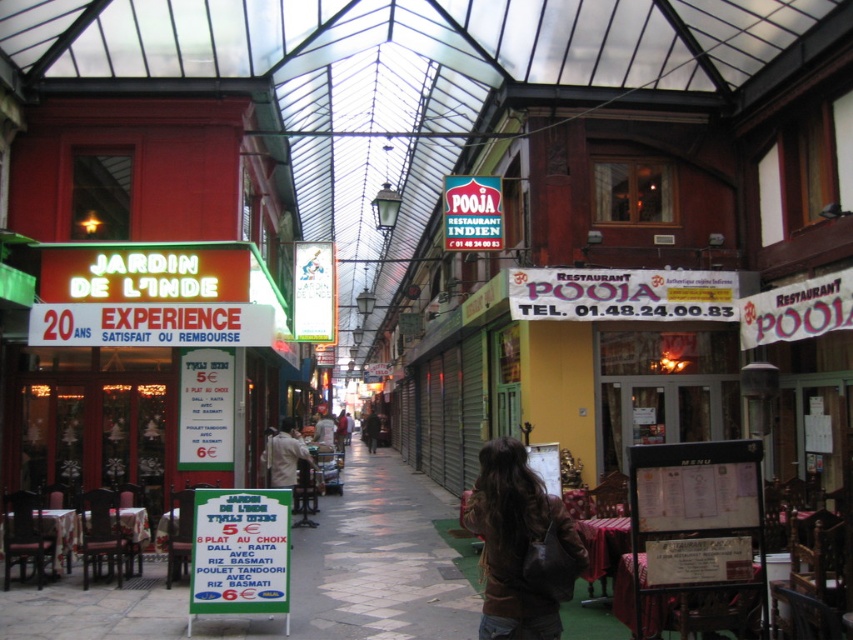
Can you confirm if matte plastic sign at center is positioned to the right of light brown leather jacket at center?

Yes, matte plastic sign at center is to the right of light brown leather jacket at center.

Does matte plastic sign at center lie in front of light brown leather jacket at center?

That is True.

At what (x,y) coordinates should I click in order to perform the action: click on matte plastic sign at center. Please return your answer as a coordinate pair (x, y). Looking at the image, I should click on (473, 212).

Is green plastic signboard at center thinner than dark brown leather jacket at center?

Indeed, green plastic signboard at center has a lesser width compared to dark brown leather jacket at center.

Where is `green plastic signboard at center`? The image size is (853, 640). green plastic signboard at center is located at coordinates (241, 552).

Who is more distant from viewer, (527, 508) or (457, 220)?

Point (457, 220)

Is brown leather jacket at center shorter than matte plastic sign at center?

Correct, brown leather jacket at center is not as tall as matte plastic sign at center.

The height and width of the screenshot is (640, 853). In order to click on brown leather jacket at center in this screenshot , I will do `click(515, 541)`.